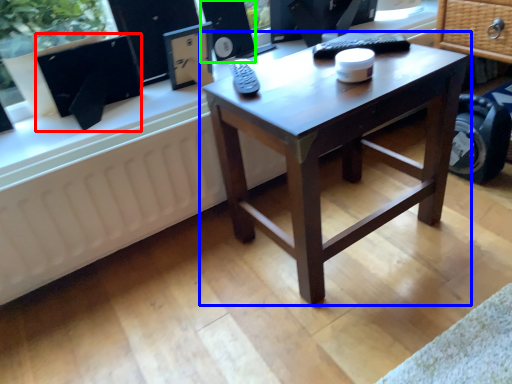
Question: Based on their relative distances, which object is nearer to computer monitor (highlighted by a red box)? Choose from coffee table (highlighted by a blue box) and speaker (highlighted by a green box).

Choices:
 (A) coffee table
 (B) speaker

Answer: (B)